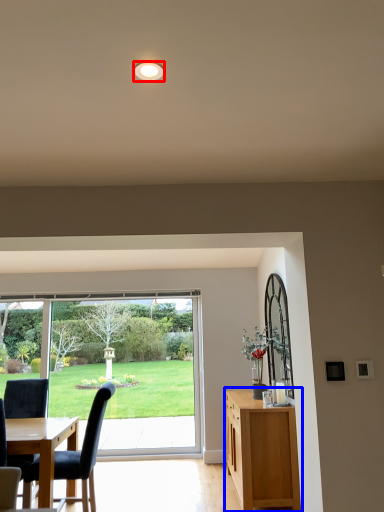
Question: Which object is closer to the camera taking this photo, lighting (highlighted by a red box) or cabinetry (highlighted by a blue box)?

Choices:
 (A) lighting
 (B) cabinetry

Answer: (A)